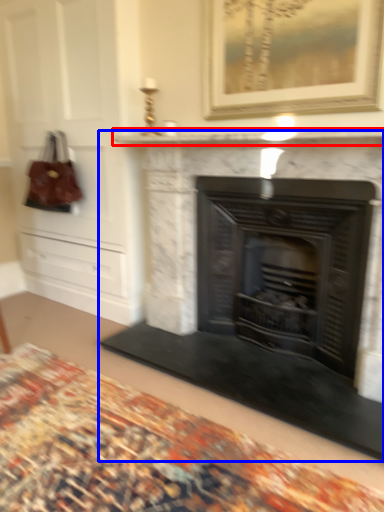
Question: Which object is further to the camera taking this photo, mantle (highlighted by a red box) or fireplace (highlighted by a blue box)?

Choices:
 (A) mantle
 (B) fireplace

Answer: (B)